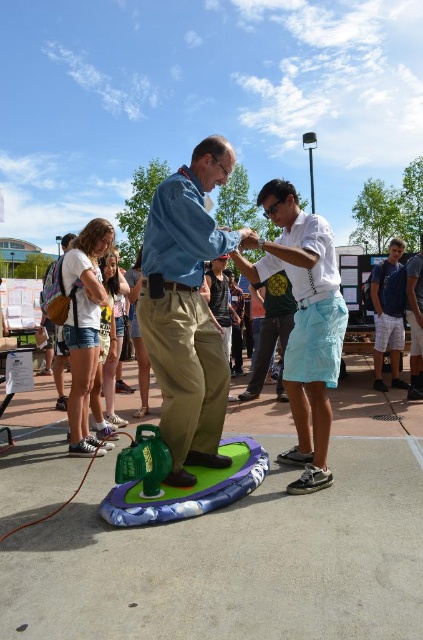
You are a photographer positioned at the center of the scene. You want to take a photo that includes both the blue denim shirt at center and the blue denim shorts at lower right. Which object should you adjust your focus on first to ensure both are in the frame?

You should focus on the blue denim shirt at center first since it is closer to you than the blue denim shorts at lower right, allowing you to adjust the framing to include both.

You are a photographer trying to capture a group photo of the blue denim shirt at center and the white cotton shirt at center. Since you want to ensure both are clearly visible, which person should you position closer to the camera to avoid being cut off?

The blue denim shirt at center should be positioned closer to the camera because it occupies less space than the white cotton shirt at center, making it easier to fit within the frame without being cut off.